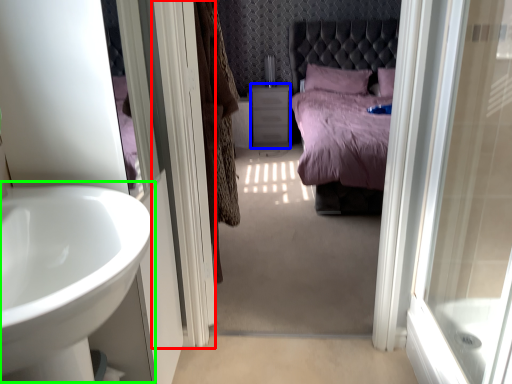
Question: Estimate the real-world distances between objects in this image. Which object is closer to screen door (highlighted by a red box), vanity (highlighted by a blue box) or sink (highlighted by a green box)?

Choices:
 (A) vanity
 (B) sink

Answer: (B)